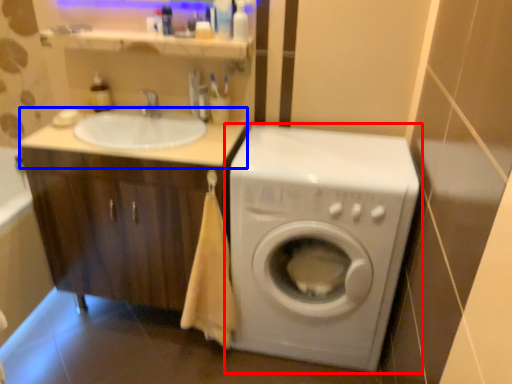
Question: Among these objects, which one is farthest to the camera, washing machine (highlighted by a red box) or counter top (highlighted by a blue box)?

Choices:
 (A) washing machine
 (B) counter top

Answer: (B)